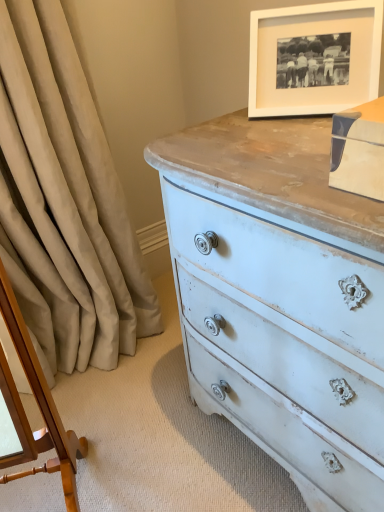
Question: From the image's perspective, is beige fabric curtain at left above or below white matte picture frame at upper right?

Choices:
 (A) above
 (B) below

Answer: (B)

Question: Is point (77, 224) closer or farther from the camera than point (251, 12)?

Choices:
 (A) closer
 (B) farther

Answer: (B)

Question: Estimate the real-world distances between objects in this image. Which object is closer to the beige fabric curtain at left?

Choices:
 (A) wooden changing table at left
 (B) white matte picture frame at upper right

Answer: (A)

Question: Which object is the closest to the wooden changing table at left?

Choices:
 (A) white matte picture frame at upper right
 (B) beige fabric curtain at left

Answer: (B)